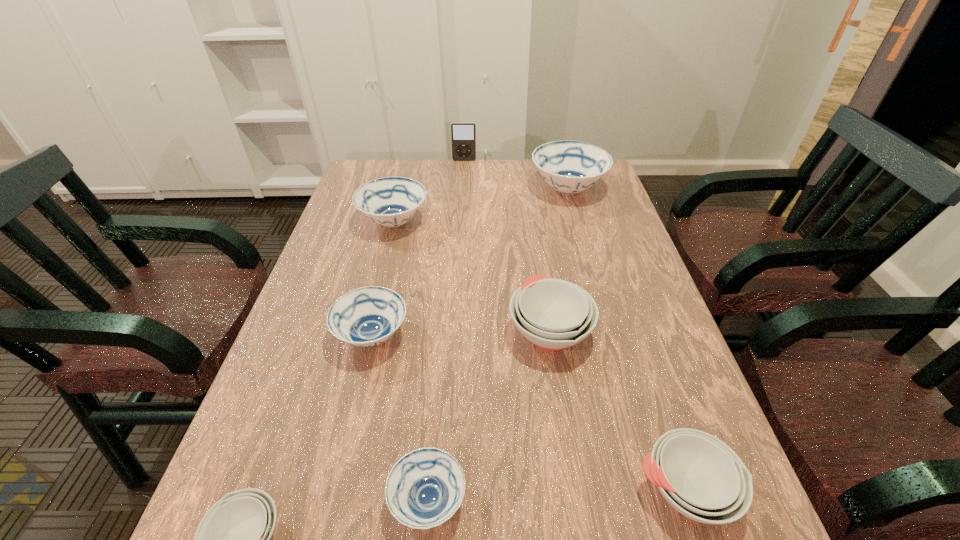
In the image, there is a desktop. In order to click on vacant region at the far edge in this screenshot , I will do `click(444, 178)`.

Identify the location of free space at the near edge of the desktop. (360, 539).

At what (x,y) coordinates should I click in order to perform the action: click on vacant point at the left edge. Please return your answer as a coordinate pair (x, y). Looking at the image, I should click on (312, 323).

Where is `free space at the right edge`? Image resolution: width=960 pixels, height=540 pixels. free space at the right edge is located at coordinates (647, 479).

Locate an element on the screen. The image size is (960, 540). vacant space at the far right corner is located at coordinates (605, 184).

The image size is (960, 540). I want to click on unoccupied area between the third farthest blue soup bowl and the iPod, so click(x=419, y=248).

The width and height of the screenshot is (960, 540). I want to click on free space between the tallest soup bowl and the rightmost white soup bowl, so click(626, 340).

Image resolution: width=960 pixels, height=540 pixels. Find the location of `free space between the farthest white soup bowl and the tallest soup bowl`. free space between the farthest white soup bowl and the tallest soup bowl is located at coordinates (559, 260).

This screenshot has height=540, width=960. What are the coordinates of `vacant area that lies between the rightmost white soup bowl and the third biggest blue soup bowl` in the screenshot? It's located at (529, 413).

Locate an element on the screen. The width and height of the screenshot is (960, 540). free spot between the rightmost white soup bowl and the third farthest blue soup bowl is located at coordinates (529, 413).